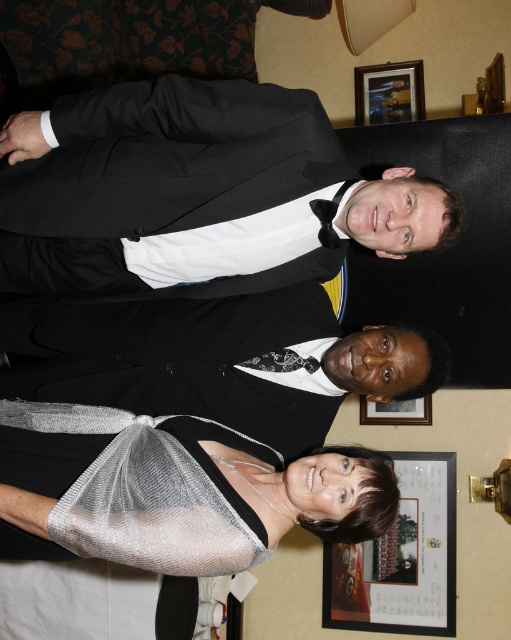
In the scene shown: You are a photographer setting up a camera to capture the three people in the scene. The camera is positioned such that it can only focus on objects within a 2.5 meters range. Will both the silver mesh shawl at lower center and the wooden picture frame at upper center be in focus at the same time?

The silver mesh shawl at lower center and wooden picture frame at upper center are 2.51 meters apart. Since the camera can only focus within a 2.5 meters range, the distance between them exceeds the focus range, so they cannot both be in focus simultaneously.

You are organizing a formal event and need to decide which item to place on a small table that can only accommodate one of the two items. Based on their sizes, which item from the image would you choose between the silver mesh shawl at lower center and the wooden picture frame at upper center?

The silver mesh shawl at lower center is larger in size than the wooden picture frame at upper center, so the wooden picture frame at upper center would be the better choice for the small table since it is smaller and fits better.

You are a photographer setting up for an event. You need to ensure that the black satin tuxedo at upper center and the wooden picture frame at lower right are both visible in your shot. Based on their positions, which object is closer to the camera?

The black satin tuxedo at upper center is closer to the camera because it is in front of the wooden picture frame at lower right.